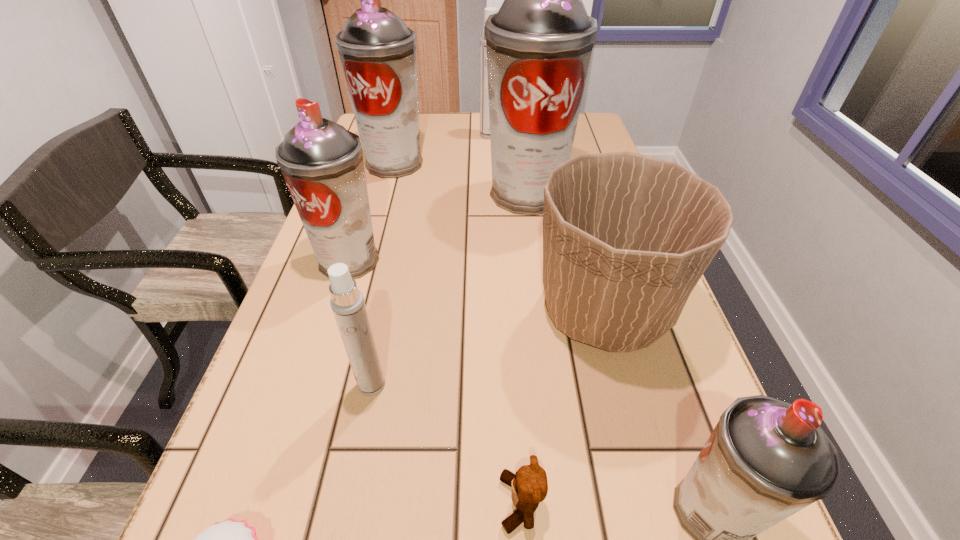
Find the location of a particular element. free location located 0.310m on the front-facing side of the teddy bear is located at coordinates (278, 503).

At what (x,y) coordinates should I click in order to perform the action: click on object at the far edge. Please return your answer as a coordinate pair (x, y). This screenshot has width=960, height=540. Looking at the image, I should click on (484, 98).

Find the location of a particular element. This screenshot has width=960, height=540. aerosol can situated at the right edge is located at coordinates (539, 44).

Where is `flowerpot that is at the right edge`? The width and height of the screenshot is (960, 540). flowerpot that is at the right edge is located at coordinates (x=626, y=237).

Identify the location of free space at the far edge. This screenshot has width=960, height=540. (425, 119).

The height and width of the screenshot is (540, 960). Find the location of `blank space at the left edge of the desktop`. blank space at the left edge of the desktop is located at coordinates (316, 437).

Find the location of a particular element. The height and width of the screenshot is (540, 960). free space at the right edge of the desktop is located at coordinates (684, 530).

Find the location of a particular element. This screenshot has width=960, height=540. empty space between the nearer white aerosol can and the right white aerosol can is located at coordinates (430, 260).

The height and width of the screenshot is (540, 960). I want to click on blank region between the farther white aerosol can and the second nearest gray aerosol can, so click(420, 198).

Locate an element on the screen. This screenshot has height=540, width=960. vacant space that is in between the teddy bear and the second biggest gray aerosol can is located at coordinates (458, 333).